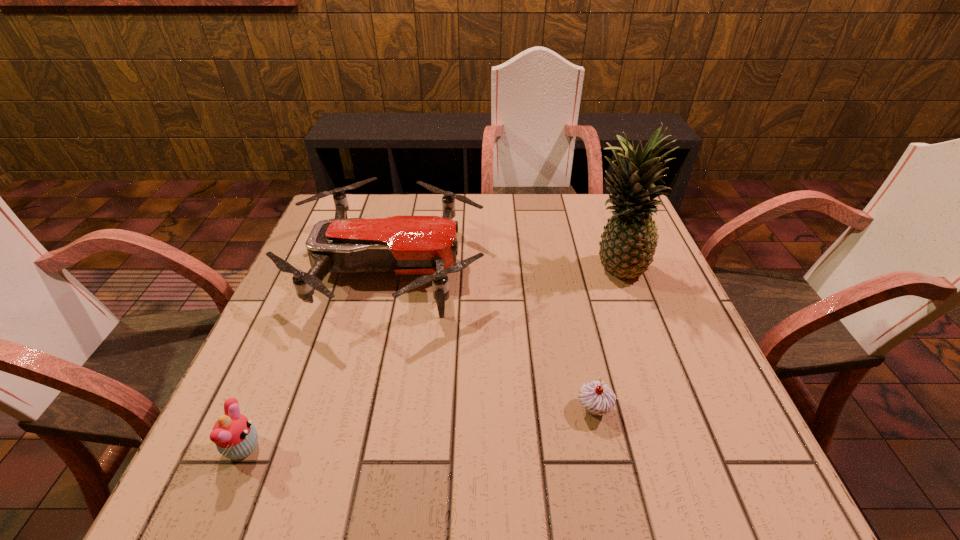
This screenshot has width=960, height=540. Find the location of `object positioned at the near edge`. object positioned at the near edge is located at coordinates (235, 436).

Image resolution: width=960 pixels, height=540 pixels. I want to click on drone located in the left edge section of the desktop, so click(x=403, y=245).

Where is `cupcake at the left edge`? This screenshot has height=540, width=960. cupcake at the left edge is located at coordinates (235, 436).

Locate an element on the screen. The image size is (960, 540). object located at the right edge is located at coordinates (628, 243).

Identify the location of object present at the far left corner. (403, 245).

Image resolution: width=960 pixels, height=540 pixels. In order to click on object present at the near left corner in this screenshot , I will do `click(235, 436)`.

This screenshot has height=540, width=960. What are the coordinates of `vacant space at the far edge of the desktop` in the screenshot? It's located at (513, 235).

The image size is (960, 540). Find the location of `vacant space at the near edge of the desktop`. vacant space at the near edge of the desktop is located at coordinates (564, 487).

Find the location of a particular element. vacant space at the left edge of the desktop is located at coordinates tap(292, 443).

You are a GUI agent. You are given a task and a screenshot of the screen. Output one action in this format:
    pyautogui.click(x=<x>, y=<y>)
    Task: Click on the vacant space at the right edge
    
    Given the screenshot: What is the action you would take?
    pyautogui.click(x=652, y=304)